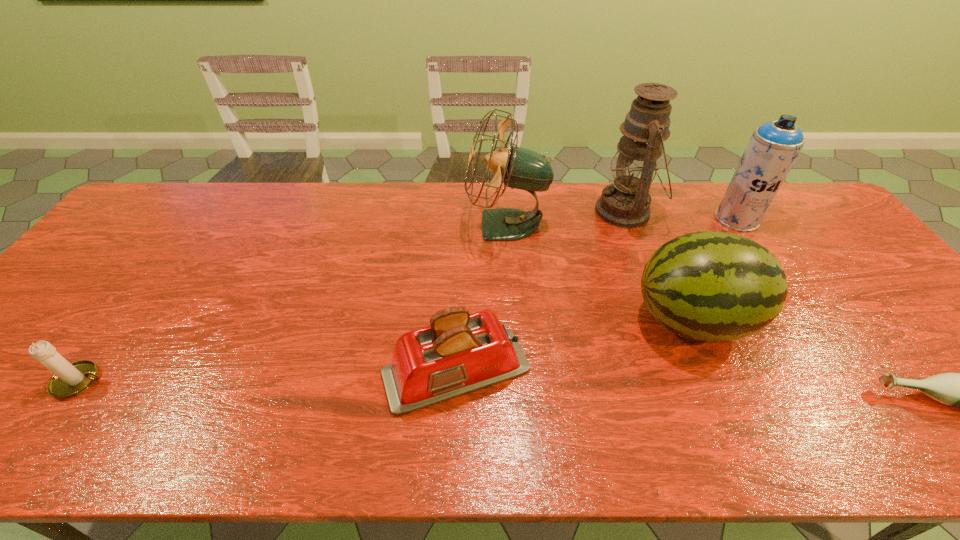
You are a GUI agent. You are given a task and a screenshot of the screen. Output one action in this format:
    pyautogui.click(x=<x>, y=<y>)
    Task: Click on the object that is at the near edge
    The image size is (960, 540).
    Given the screenshot: What is the action you would take?
    pyautogui.click(x=459, y=352)

Locate an element on the screen. The image size is (960, 540). object that is at the left edge is located at coordinates (69, 380).

You are a GUI agent. You are given a task and a screenshot of the screen. Output one action in this format:
    pyautogui.click(x=<x>, y=<y>)
    Task: Click on the vacant space at the far edge
    This screenshot has height=540, width=960.
    Given the screenshot: What is the action you would take?
    pyautogui.click(x=276, y=205)

Identify the location of vacant space at the near edge of the desktop. (563, 431).

This screenshot has width=960, height=540. Find the location of `vacant region at the left edge of the desktop`. vacant region at the left edge of the desktop is located at coordinates (x=154, y=254).

Where is `vacant region at the far left corner of the desktop`? The image size is (960, 540). vacant region at the far left corner of the desktop is located at coordinates (164, 191).

Where is `free spot between the aerosol can and the toaster`? The image size is (960, 540). free spot between the aerosol can and the toaster is located at coordinates (596, 295).

Find the location of a particular element. This screenshot has width=960, height=540. unoccupied position between the aerosol can and the oil lamp is located at coordinates (682, 215).

Where is `vacant area that lies between the watermelon and the leftmost object`? The height and width of the screenshot is (540, 960). vacant area that lies between the watermelon and the leftmost object is located at coordinates (387, 350).

What are the coordinates of `free point between the sixth tallest object and the aerosol can` in the screenshot? It's located at (409, 300).